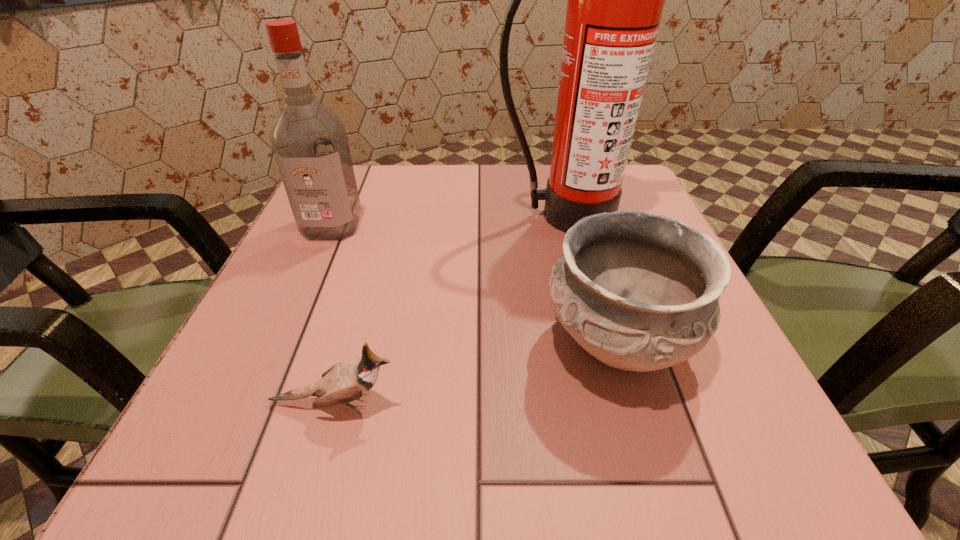
In order to click on vacant region that satisfies the following two spatial constraints: 1. on the front-facing side of the fire extinguisher; 2. at the face of the shortest object in this screenshot , I will do `click(612, 403)`.